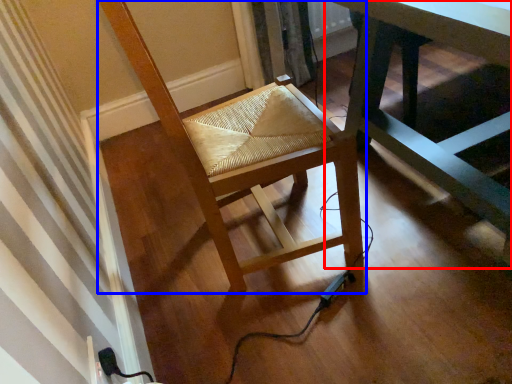
Question: Among these objects, which one is farthest to the camera, table (highlighted by a red box) or chair (highlighted by a blue box)?

Choices:
 (A) table
 (B) chair

Answer: (B)